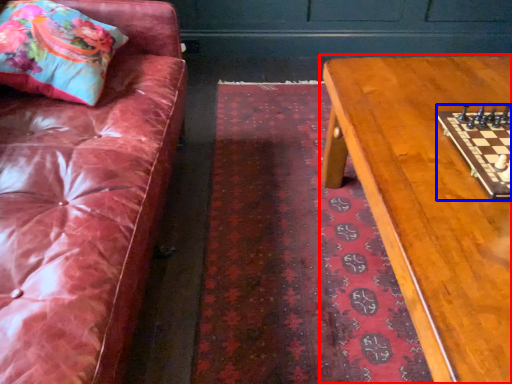
Question: Which point is further to the camera, table (highlighted by a red box) or board game (highlighted by a blue box)?

Choices:
 (A) table
 (B) board game

Answer: (B)